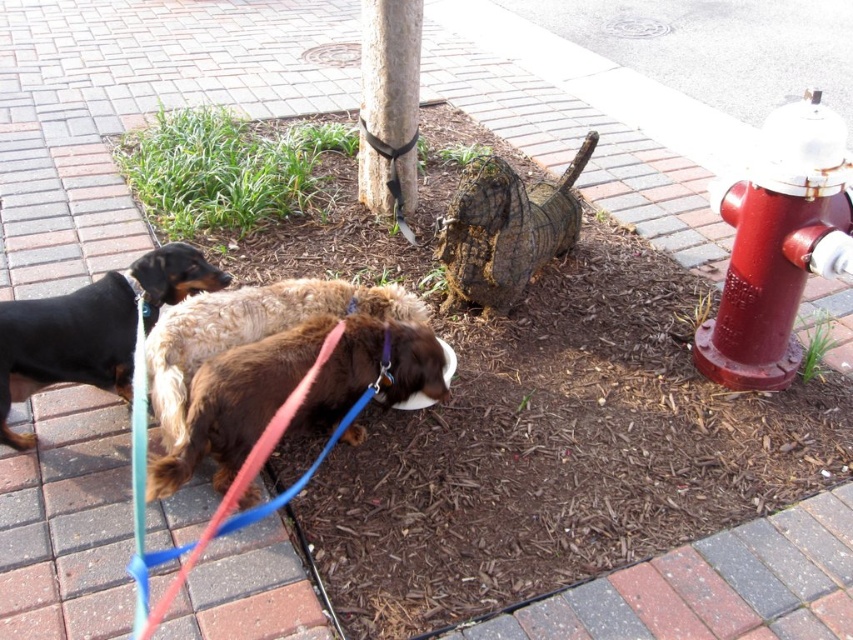
Between brown fuzzy dog at center and smooth brown pole at center, which one appears on the left side from the viewer's perspective?

brown fuzzy dog at center

Does brown fuzzy dog at center have a lesser height compared to smooth brown pole at center?

Correct, brown fuzzy dog at center is not as tall as smooth brown pole at center.

Who is more distant from viewer, [239,403] or [360,179]?

The point [360,179] is more distant.

Image resolution: width=853 pixels, height=640 pixels. Find the location of `brown fuzzy dog at center`. brown fuzzy dog at center is located at coordinates (291, 390).

Which is below, black smooth dog at left or smooth brown pole at center?

black smooth dog at left

The height and width of the screenshot is (640, 853). What are the coordinates of `black smooth dog at left` in the screenshot? It's located at (91, 328).

Is point (786, 147) farther from camera compared to point (22, 371)?

Yes, it is behind point (22, 371).

Does red metallic hydrant at right appear on the right side of black smooth dog at left?

Yes, red metallic hydrant at right is to the right of black smooth dog at left.

Does point (776, 285) come closer to viewer compared to point (15, 388)?

No, it is behind (15, 388).

The height and width of the screenshot is (640, 853). Identify the location of red metallic hydrant at right. (776, 244).